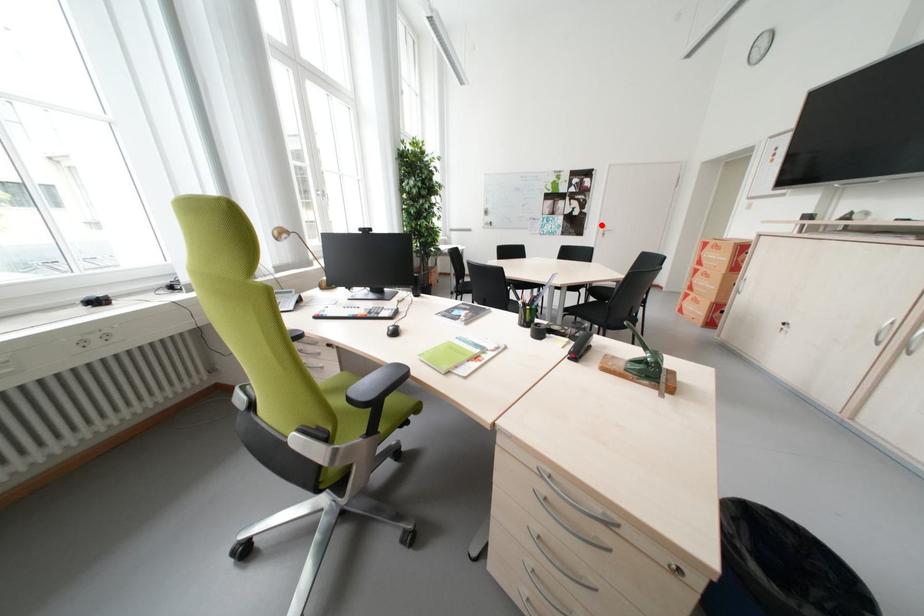
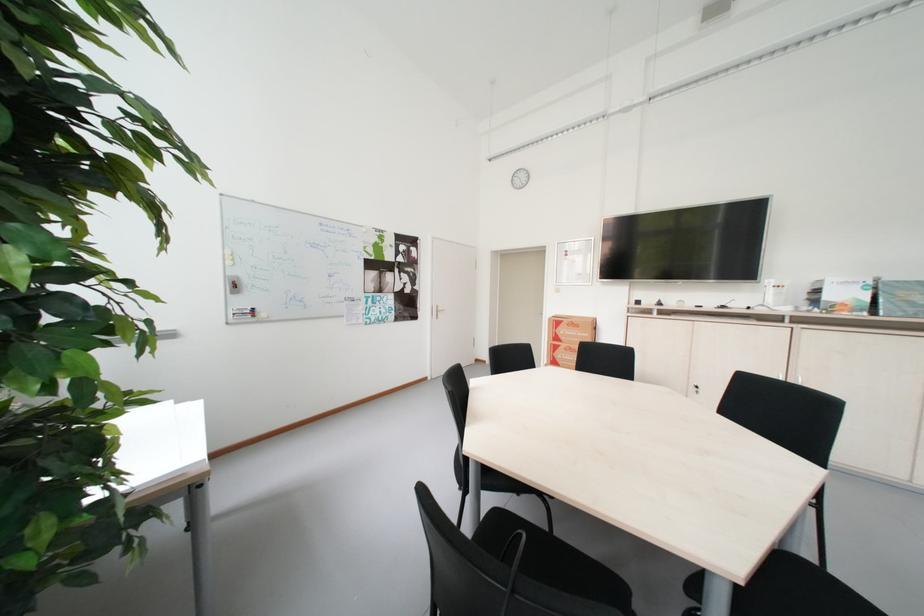
Find the pixel in the second image that matches the highlighted location in the first image.

(434, 305)